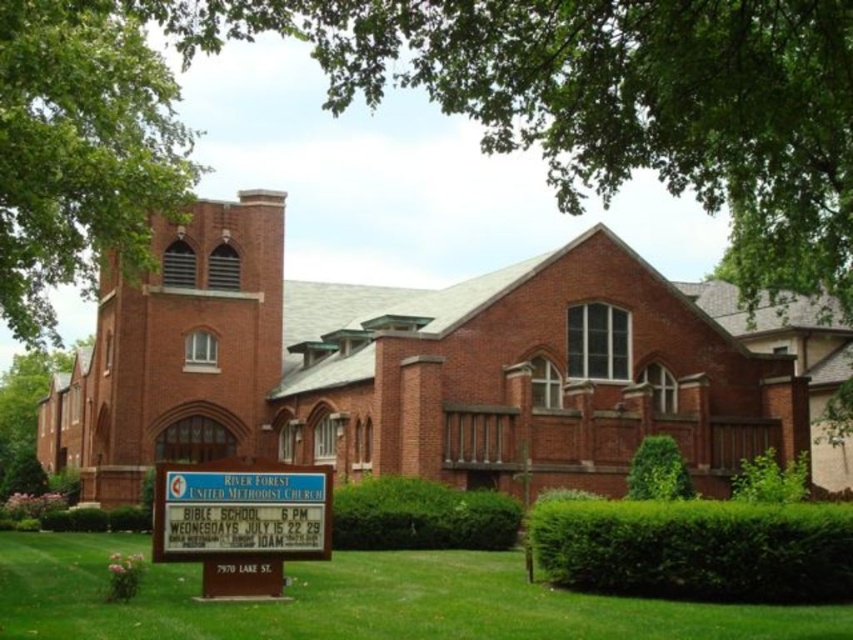
You are standing in front of the church and want to walk from the wooden signboard to the entrance. The wooden signboard is located at point [209,598]. The entrance is at point [51,104]. Which point do you need to walk towards?

You need to walk towards point [51,104] because it is the entrance located behind the wooden signboard at point [209,598].

You are a visitor approaching the church and notice the green grass at lower center and the green leafy bush at right. Which object is closer to the entrance of the church?

The green grass at lower center is closer to the entrance of the church because it is positioned under the green leafy bush at right, indicating it is in front of the bush and therefore nearer to the entrance.

You are standing in front of the brick church and want to take a photo that includes both the wooden signboard and the green leafy tree at upper left. Based on their positions, which object should you position closer to the left side of your camera frame?

The green leafy tree at upper left is located at point 0.233 on the x and y axis, so you should position the green leafy tree at upper left closer to the left side of your camera frame to include both the wooden signboard and the tree in the photo.